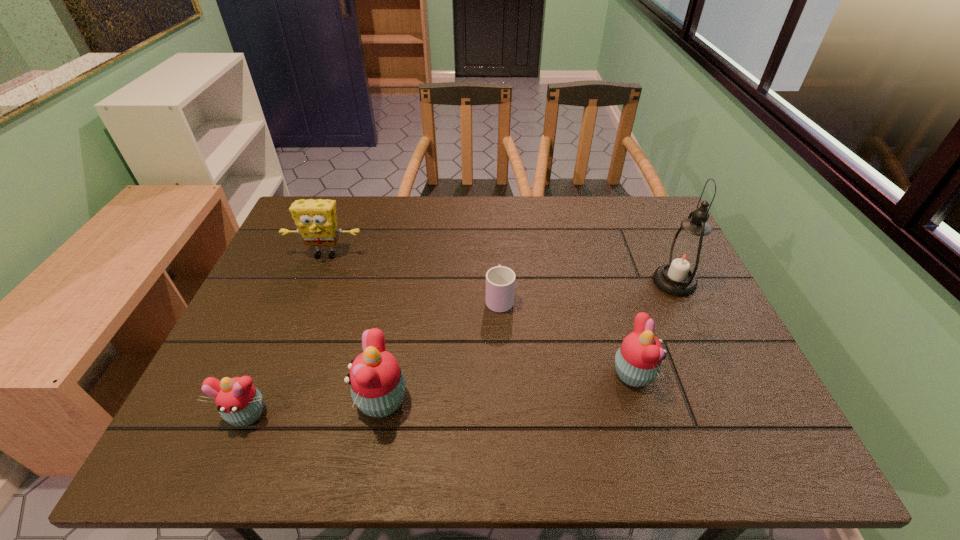
Where is `the shortest cupcake`? This screenshot has height=540, width=960. the shortest cupcake is located at coordinates (238, 401).

At what (x,y) coordinates should I click in order to perform the action: click on the leftmost cupcake. Please return your answer as a coordinate pair (x, y). The width and height of the screenshot is (960, 540). Looking at the image, I should click on (238, 401).

Image resolution: width=960 pixels, height=540 pixels. I want to click on the second cupcake from right to left, so click(378, 386).

Locate an element on the screen. the fourth tallest object is located at coordinates (638, 360).

Image resolution: width=960 pixels, height=540 pixels. Identify the location of the fifth object from left to right. (638, 360).

Locate an element on the screen. The image size is (960, 540). oil lamp is located at coordinates (684, 257).

You are a GUI agent. You are given a task and a screenshot of the screen. Output one action in this format:
    pyautogui.click(x=<x>, y=<y>)
    Task: Click on the tallest object
    
    Given the screenshot: What is the action you would take?
    pyautogui.click(x=684, y=257)

In order to click on sponge in this screenshot , I will do `click(316, 221)`.

Where is `the fourth object from left to right`? The width and height of the screenshot is (960, 540). the fourth object from left to right is located at coordinates (500, 281).

At what (x,y) coordinates should I click in order to perform the action: click on the shortest object. Please return your answer as a coordinate pair (x, y). This screenshot has height=540, width=960. Looking at the image, I should click on 500,281.